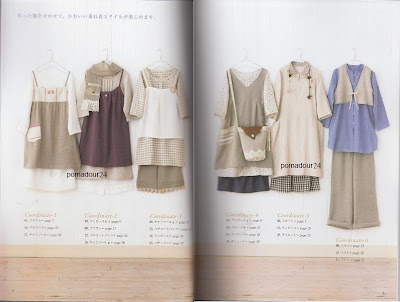
Find the location of a particular element. metallic clothes hangers is located at coordinates (50, 60), (105, 60), (160, 60), (244, 59), (300, 59), (354, 60).